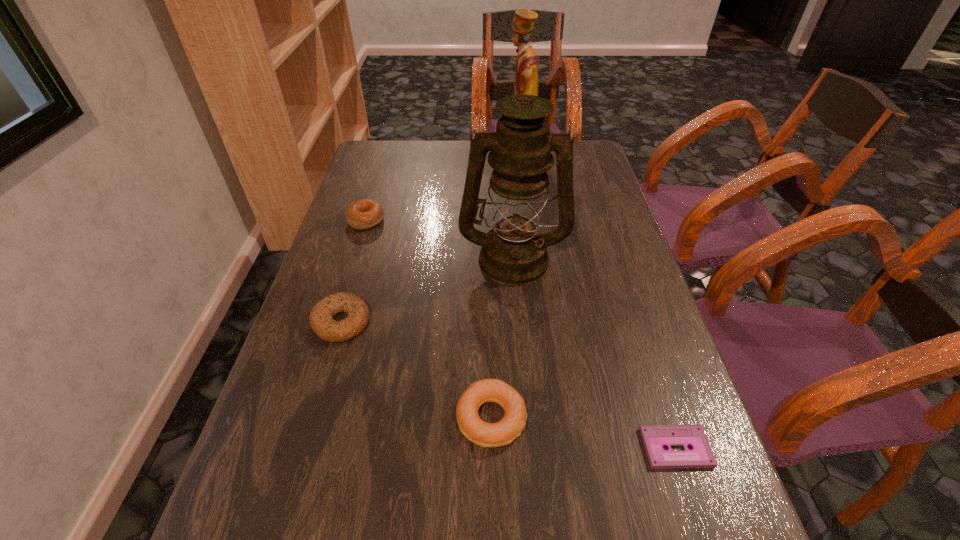
Identify which bagel is located as the nearest to the fifth nearest object. Please provide its 2D coordinates. Your answer should be formatted as a tuple, i.e. [(x, y)], where the tuple contains the x and y coordinates of a point satisfying the conditions above.

[(321, 320)]

Identify the location of bagel that can be found as the third closest to the farthest object. This screenshot has height=540, width=960. (504, 432).

I want to click on vacant space that satisfies the following two spatial constraints: 1. on the front side of the fifth nearest object; 2. on the left side of the fourth farthest object, so click(335, 321).

Where is `free location that satisfies the following two spatial constraints: 1. on the front side of the farthest bagel; 2. on the right side of the rightmost object`? This screenshot has width=960, height=540. free location that satisfies the following two spatial constraints: 1. on the front side of the farthest bagel; 2. on the right side of the rightmost object is located at coordinates (297, 448).

Locate an element on the screen. vacant space that satisfies the following two spatial constraints: 1. on the back side of the second nearest bagel; 2. on the right side of the third farthest object is located at coordinates (360, 258).

The width and height of the screenshot is (960, 540). Find the location of `free point that satisfies the following two spatial constraints: 1. on the front side of the fourth farthest object; 2. on the left side of the farthest bagel`. free point that satisfies the following two spatial constraints: 1. on the front side of the fourth farthest object; 2. on the left side of the farthest bagel is located at coordinates (335, 321).